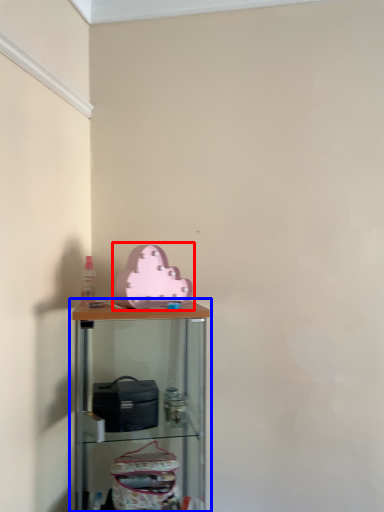
Question: Among these objects, which one is farthest to the camera, toy (highlighted by a red box) or shelf (highlighted by a blue box)?

Choices:
 (A) toy
 (B) shelf

Answer: (A)